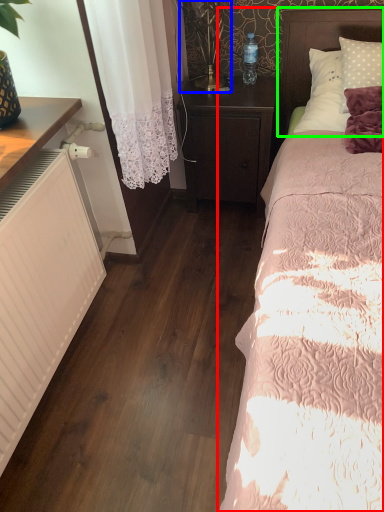
Question: Based on their relative distances, which object is farther from bed (highlighted by a red box)? Choose from table lamp (highlighted by a blue box) and headboard (highlighted by a green box).

Choices:
 (A) table lamp
 (B) headboard

Answer: (A)